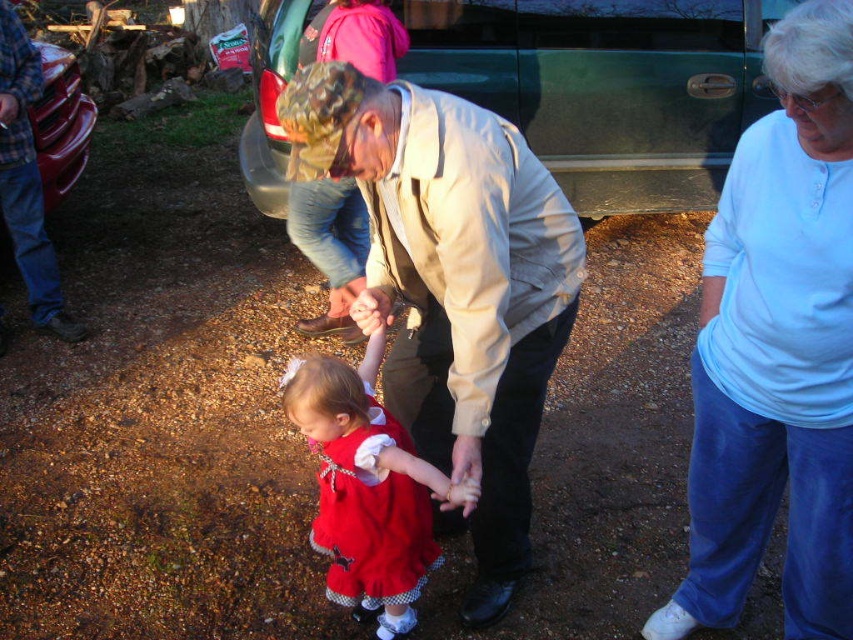
You are standing in the scene and want to place a small flag at the point closer to you between point (827, 266) and point (390, 632). Which point should you choose?

You should choose point (827, 266) because it is closer to the viewer than point (390, 632).